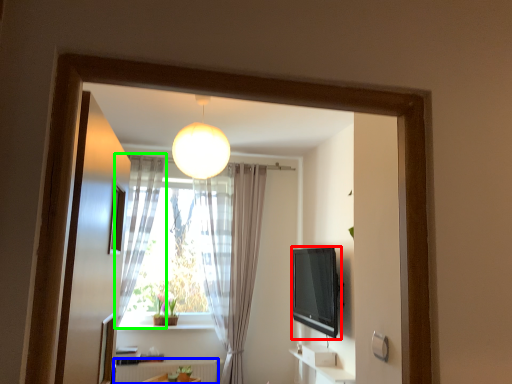
Question: Considering the real-world distances, which object is closest to electronic (highlighted by a red box)? radiator (highlighted by a blue box) or curtain (highlighted by a green box).

Choices:
 (A) radiator
 (B) curtain

Answer: (A)